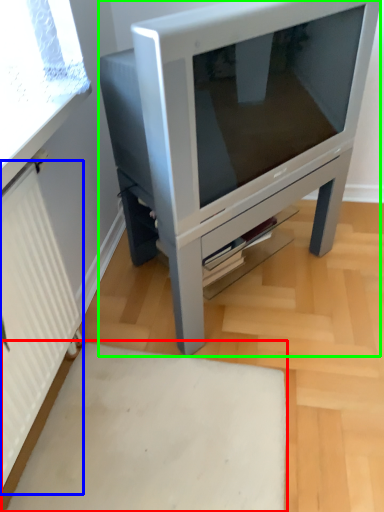
Question: Estimate the real-world distances between objects in this image. Which object is farther from plain (highlighted by a red box), radiator (highlighted by a blue box) or furniture (highlighted by a green box)?

Choices:
 (A) radiator
 (B) furniture

Answer: (B)